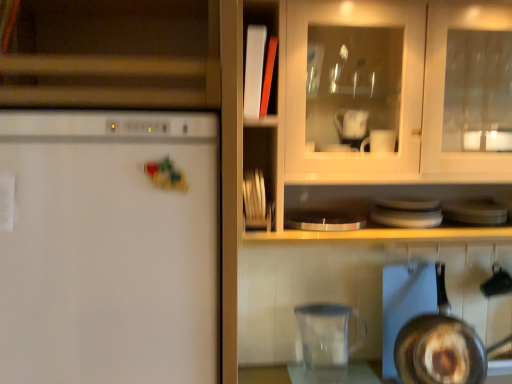
Question: Are white matte refrigerator at left and shiny silver frying pan at lower right beside each other?

Choices:
 (A) yes
 (B) no

Answer: (B)

Question: Can you confirm if white matte refrigerator at left is taller than shiny silver frying pan at lower right?

Choices:
 (A) yes
 (B) no

Answer: (A)

Question: Is white matte refrigerator at left not near shiny silver frying pan at lower right?

Choices:
 (A) no
 (B) yes

Answer: (A)

Question: Does white matte refrigerator at left have a smaller size compared to shiny silver frying pan at lower right?

Choices:
 (A) no
 (B) yes

Answer: (A)

Question: Considering the relative sizes of white matte refrigerator at left and shiny silver frying pan at lower right in the image provided, is white matte refrigerator at left wider than shiny silver frying pan at lower right?

Choices:
 (A) no
 (B) yes

Answer: (B)

Question: From the image's perspective, is white matte refrigerator at left below shiny silver frying pan at lower right?

Choices:
 (A) no
 (B) yes

Answer: (A)

Question: Is transparent plastic pitcher at lower center positioned in front of shiny silver frying pan at lower right?

Choices:
 (A) no
 (B) yes

Answer: (A)

Question: Is transparent plastic pitcher at lower center not close to shiny silver frying pan at lower right?

Choices:
 (A) no
 (B) yes

Answer: (A)

Question: Is transparent plastic pitcher at lower center wider than shiny silver frying pan at lower right?

Choices:
 (A) yes
 (B) no

Answer: (B)

Question: From the image's perspective, would you say transparent plastic pitcher at lower center is shown under shiny silver frying pan at lower right?

Choices:
 (A) no
 (B) yes

Answer: (B)

Question: Is transparent plastic pitcher at lower center further to camera compared to shiny silver frying pan at lower right?

Choices:
 (A) no
 (B) yes

Answer: (B)

Question: Can you confirm if transparent plastic pitcher at lower center is taller than shiny silver frying pan at lower right?

Choices:
 (A) yes
 (B) no

Answer: (B)

Question: Is matte wood cabinet at upper left shorter than white matte refrigerator at left?

Choices:
 (A) no
 (B) yes

Answer: (B)